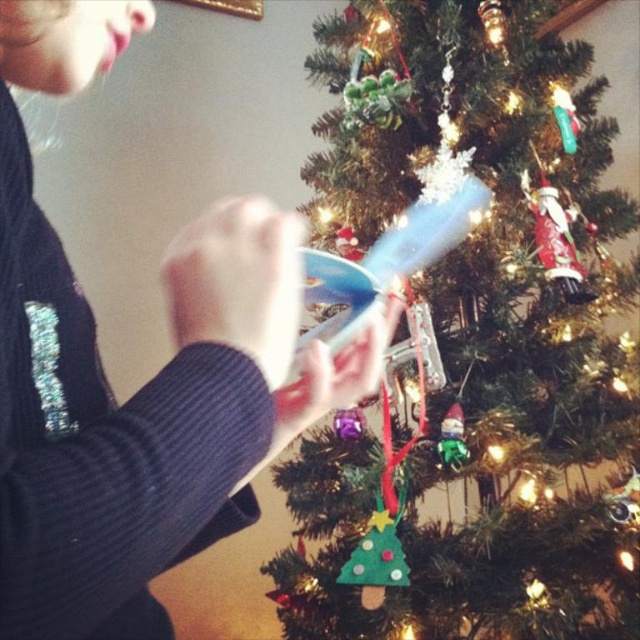
You are a delivery person who just arrived at this house to deliver a package. You need to place the package between the dark blue sweater at upper left and the satin red santa at right. The package is 40 centimeters long. Will it fit in the space between them?

The distance between the dark blue sweater at upper left and the satin red santa at right is 82.26 centimeters. Since the package is only 40 centimeters long, it will fit comfortably in the space between them.

In the scene shown: You are taking a photo of the Christmas tree and want to ensure the dark blue sweater at upper left is in focus. The camera has a depth of field that can focus on objects within 9 inches. Will the sweater be in focus?

The dark blue sweater at upper left is 9.25 inches from the camera, which is slightly beyond the 9 inch depth of field range. Therefore, the sweater may be slightly out of focus in the photo.

You are standing 1.2 meters away from the Christmas tree. You want to reach a point that is exactly 1.18 meters away from you. Is the point at coordinates point (564, 260) within your desired distance?

The point (564, 260) is 1.18 meters away from the viewer. Since you are standing 1.2 meters away from the Christmas tree, the distance between you and the point is slightly less than your desired 1.18 meters. Therefore, the point at coordinates point (564, 260) is within your desired distance.